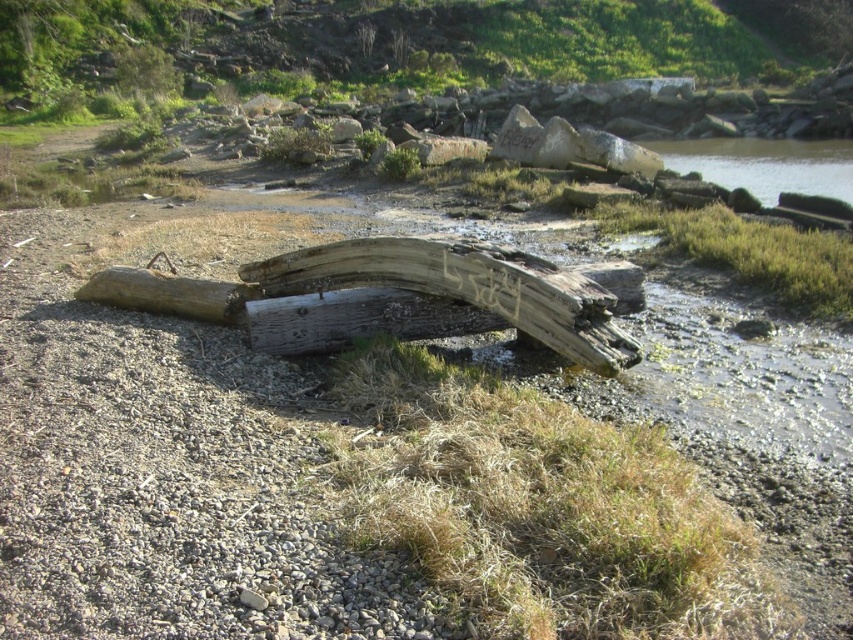
Question: Is weathered wood log at center closer to the viewer compared to clear water at right?

Choices:
 (A) yes
 (B) no

Answer: (A)

Question: Which object appears closest to the camera in this image?

Choices:
 (A) clear water at right
 (B) weathered wood log at center

Answer: (B)

Question: Can you confirm if weathered wood log at center is positioned below clear water at right?

Choices:
 (A) yes
 (B) no

Answer: (A)

Question: Which point is closer to the camera?

Choices:
 (A) (581, 282)
 (B) (697, 148)

Answer: (A)

Question: Is weathered wood log at center to the right of clear water at right from the viewer's perspective?

Choices:
 (A) yes
 (B) no

Answer: (B)